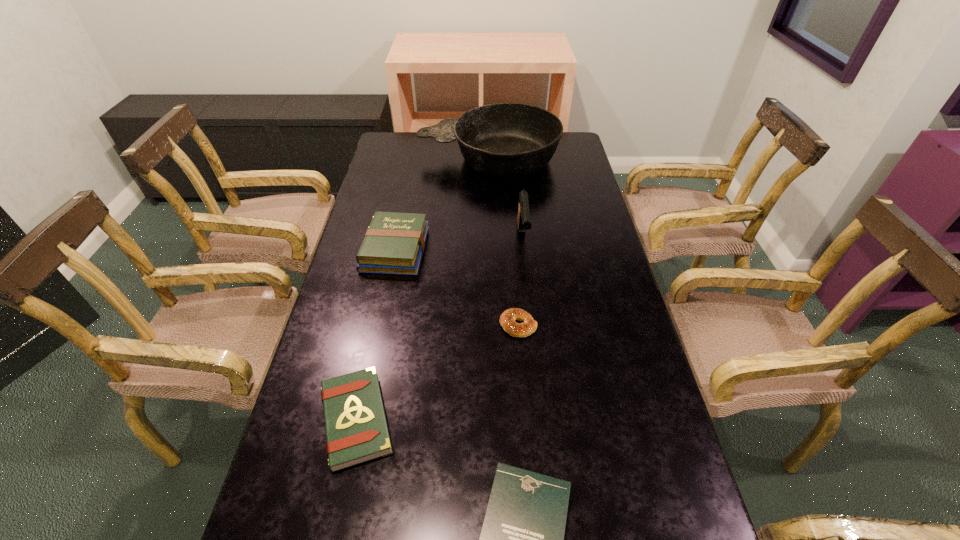
Identify which object is the second closest to the pistol. Please provide its 2D coordinates. Your answer should be formatted as a tuple, i.e. [(x, y)], where the tuple contains the x and y coordinates of a point satisfying the conditions above.

[(507, 319)]

What are the coordinates of `book that is the closest to the fourth farthest object` in the screenshot? It's located at (356, 428).

Where is `the closest book to the rightmost book`? the closest book to the rightmost book is located at coordinates (356, 428).